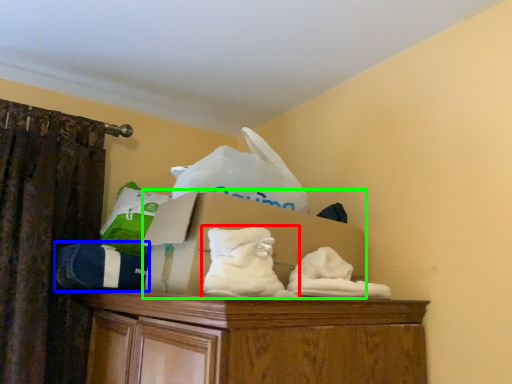
Question: Considering the real-world distances, which object is closest to sheet (highlighted by a red box)? clothing (highlighted by a blue box) or cardboard box (highlighted by a green box).

Choices:
 (A) clothing
 (B) cardboard box

Answer: (B)